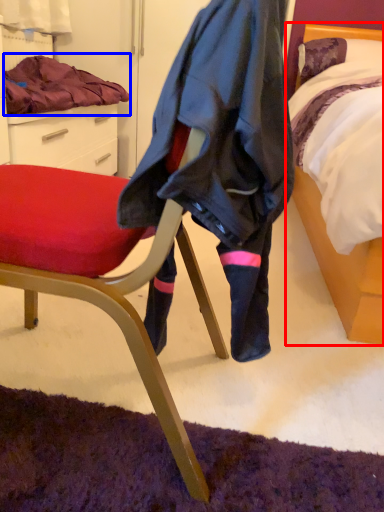
Question: Which object is further to the camera taking this photo, bed (highlighted by a red box) or blanket (highlighted by a blue box)?

Choices:
 (A) bed
 (B) blanket

Answer: (B)